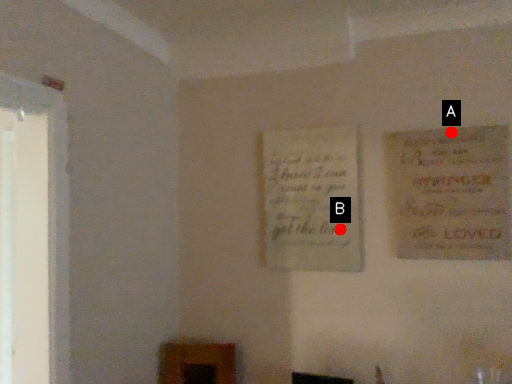
Question: Two points are circled on the image, labeled by A and B beside each circle. Which point is closer to the camera taking this photo?

Choices:
 (A) A is closer
 (B) B is closer

Answer: (A)